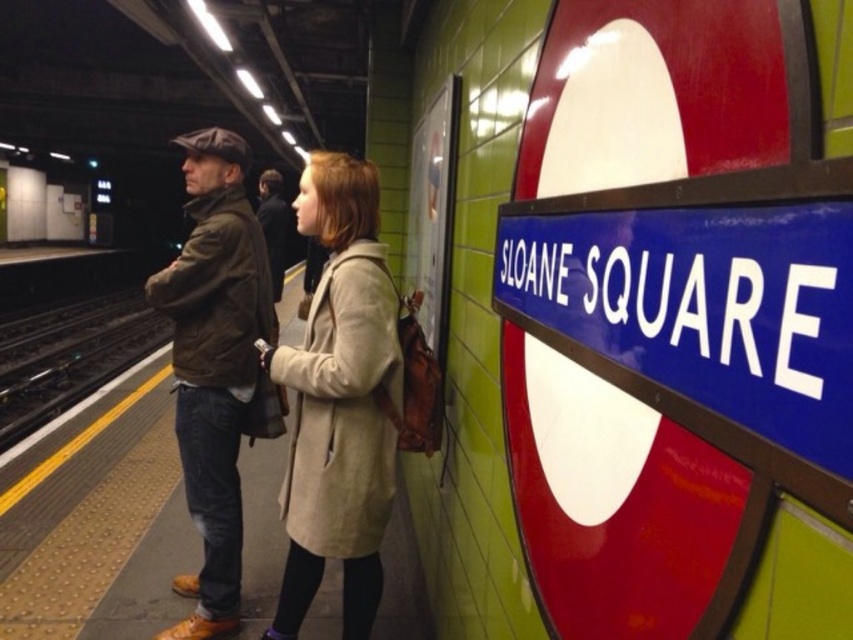
Question: Which object is the closest to the dark brown leather jacket at center?

Choices:
 (A) beige wool coat at center
 (B) brown leather jacket at center
 (C) black metal train track at left

Answer: (B)

Question: Which point appears farthest from the camera in this image?

Choices:
 (A) pyautogui.click(x=270, y=230)
 (B) pyautogui.click(x=138, y=316)
 (C) pyautogui.click(x=372, y=282)
 (D) pyautogui.click(x=230, y=257)

Answer: (B)

Question: In this image, where is beige wool coat at center located relative to brown leather jacket at center?

Choices:
 (A) right
 (B) left

Answer: (A)

Question: Is the position of brown leather jacket at center less distant than that of black metal train track at left?

Choices:
 (A) no
 (B) yes

Answer: (B)

Question: Does beige wool coat at center have a smaller size compared to dark brown leather jacket at center?

Choices:
 (A) yes
 (B) no

Answer: (B)

Question: Which of the following is the closest to the observer?

Choices:
 (A) (209, 490)
 (B) (260, 224)
 (C) (97, 372)

Answer: (A)